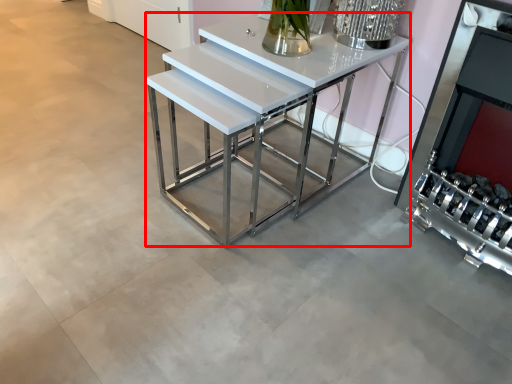
Question: From the image's perspective, where is table (annotated by the red box) located relative to fireplace?

Choices:
 (A) below
 (B) above

Answer: (B)